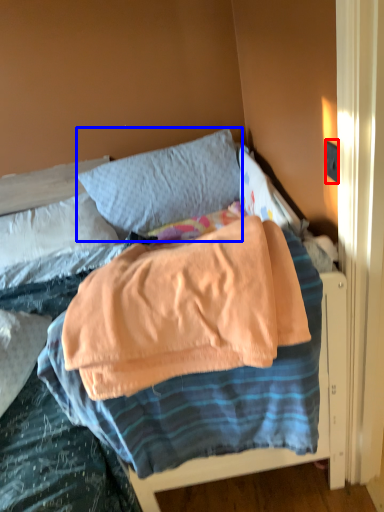
Question: Among these objects, which one is nearest to the camera, electric outlet (highlighted by a red box) or pillow (highlighted by a blue box)?

Choices:
 (A) electric outlet
 (B) pillow

Answer: (A)